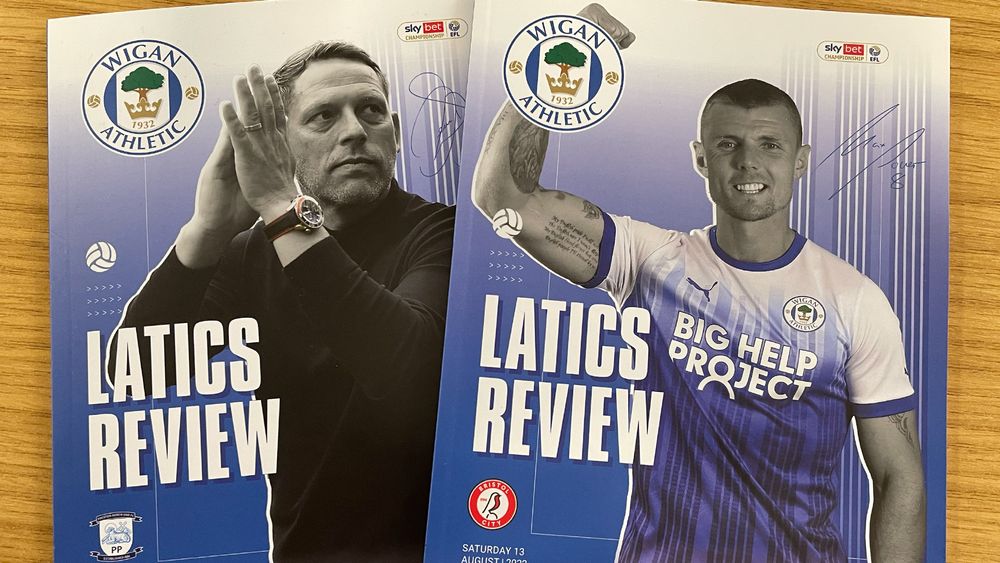
I want to click on table, so click(x=24, y=150).